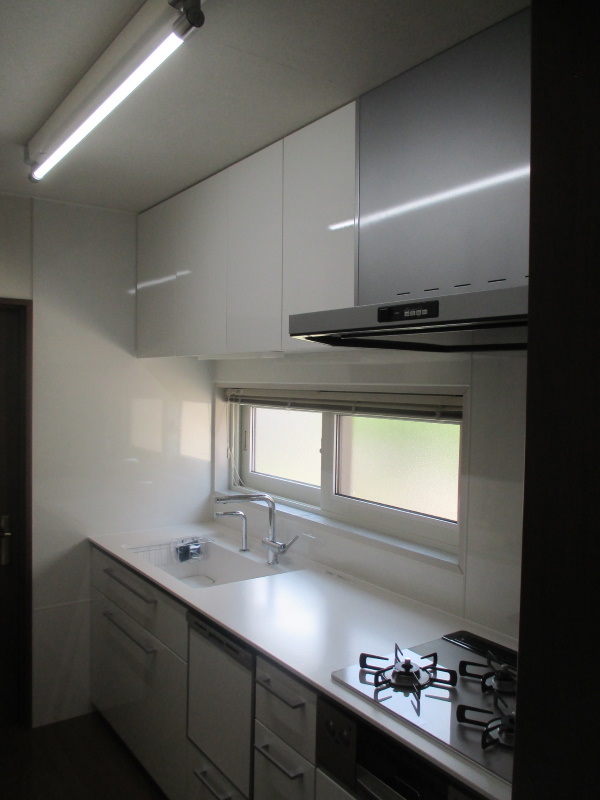
Locate an element on the screen. The image size is (600, 800). handles is located at coordinates (127, 585), (126, 634), (272, 690), (275, 762), (210, 786).